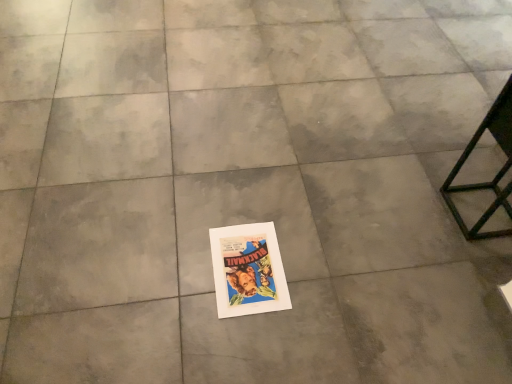
This screenshot has height=384, width=512. I want to click on vacant area in front of vibrant paper poster at center, so click(242, 344).